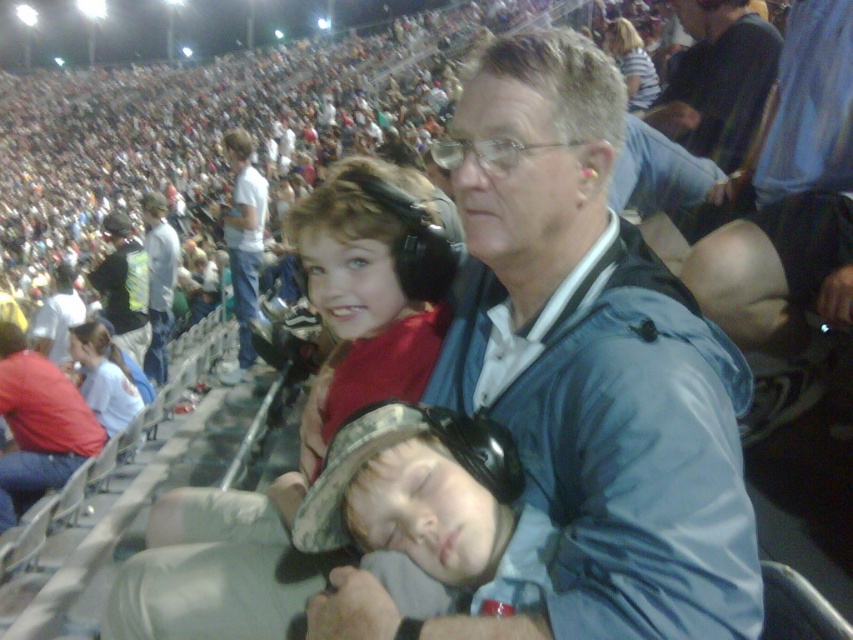
You are a photographer trying to capture a clear shot of the reflective silver helmet at upper center and the striped shirt at upper center in the stadium image. Since the reflective silver helmet is shorter than the striped shirt, which object might partially block the view of the other?

The striped shirt at upper center is taller than the reflective silver helmet at upper center, so the striped shirt could partially block the view of the reflective silver helmet.

You are a photographer standing in the stadium and want to take a photo of the two red shirts. The matte red shirt at center and the red shirt at left. Which one is closer to you?

The matte red shirt at center is closer to the viewer than the red shirt at left.

You are a photographer at the stadium and want to take a photo of both the matte red shirt at center and the red shirt at left. Which shirt should you focus on if you want to capture the one that is closer to the camera?

The matte red shirt at center is shorter than the red shirt at left, so the matte red shirt at center is closer to the camera. You should focus on the matte red shirt at center.